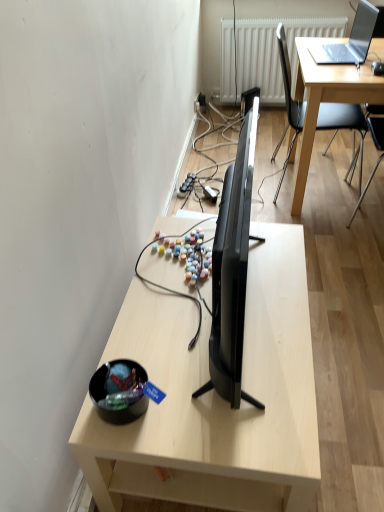
Locate an element on the screen. The image size is (384, 512). free spot above light wood desk at center (from a real-world perspective) is located at coordinates (241, 306).